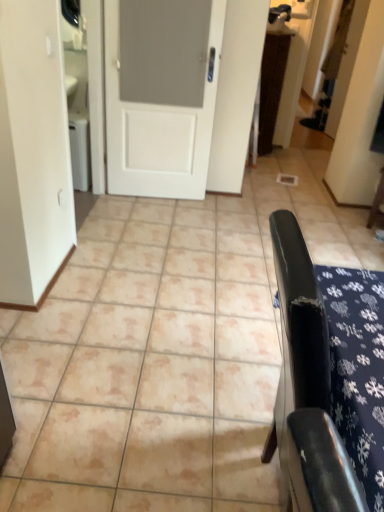
You are a GUI agent. You are given a task and a screenshot of the screen. Output one action in this format:
    pyautogui.click(x=<x>, y=<y>)
    Task: Click on the free location above beige ceramic tile at center (from a real-world perspective)
    Image resolution: width=384 pixels, height=512 pixels.
    Given the screenshot: What is the action you would take?
    pyautogui.click(x=220, y=234)